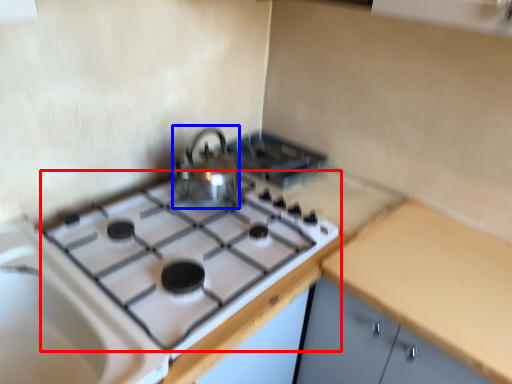
Question: Which point is further to the camera, gas stove (highlighted by a red box) or kitchen appliance (highlighted by a blue box)?

Choices:
 (A) gas stove
 (B) kitchen appliance

Answer: (B)